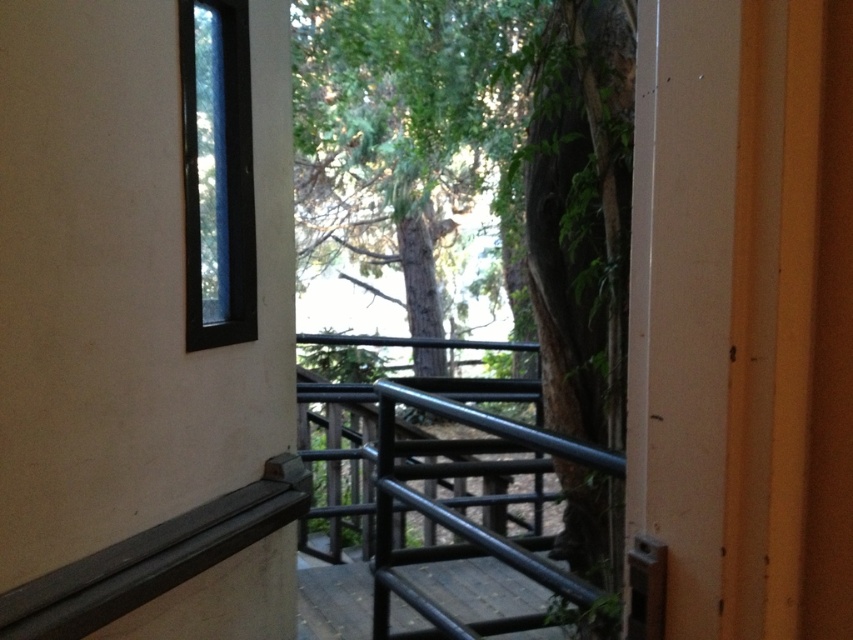
Is point (160, 20) in front of point (498, 582)?

Yes.

Between black matte door at upper left and black metal railing at center, which one appears on the left side from the viewer's perspective?

From the viewer's perspective, black matte door at upper left appears more on the left side.

Between point (86, 339) and point (415, 630), which one is positioned behind?

The point (415, 630) is more distant.

Identify the location of black matte door at upper left. The width and height of the screenshot is (853, 640). (135, 328).

From the picture: Is black metal railing at center further to the viewer compared to clear glass window at upper left?

No, it is not.

Can you confirm if black metal railing at center is wider than clear glass window at upper left?

Correct, the width of black metal railing at center exceeds that of clear glass window at upper left.

Does point (310, 396) come behind point (245, 72)?

Yes, it is behind point (245, 72).

At what (x,y) coordinates should I click in order to perform the action: click on black metal railing at center. Please return your answer as a coordinate pair (x, y). Looking at the image, I should click on (439, 509).

Which is more to the left, black matte door at upper left or green leafy tree at center?

From the viewer's perspective, black matte door at upper left appears more on the left side.

Based on the photo, is black matte door at upper left bigger than green leafy tree at center?

Yes, black matte door at upper left is bigger than green leafy tree at center.

Which is behind, point (291, 340) or point (621, 557)?

Positioned behind is point (291, 340).

Identify the location of black matte door at upper left. [135, 328].